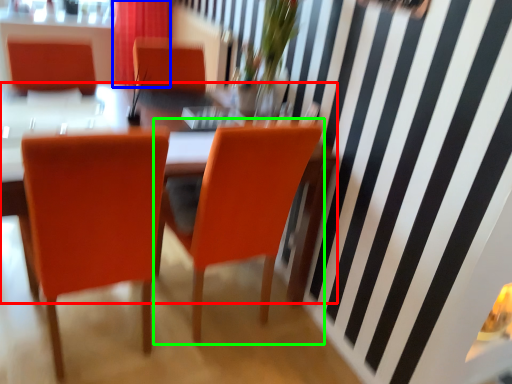
Question: Based on their relative distances, which object is farther from table (highlighted by a red box)? Choose from curtain (highlighted by a blue box) and chair (highlighted by a green box).

Choices:
 (A) curtain
 (B) chair

Answer: (A)